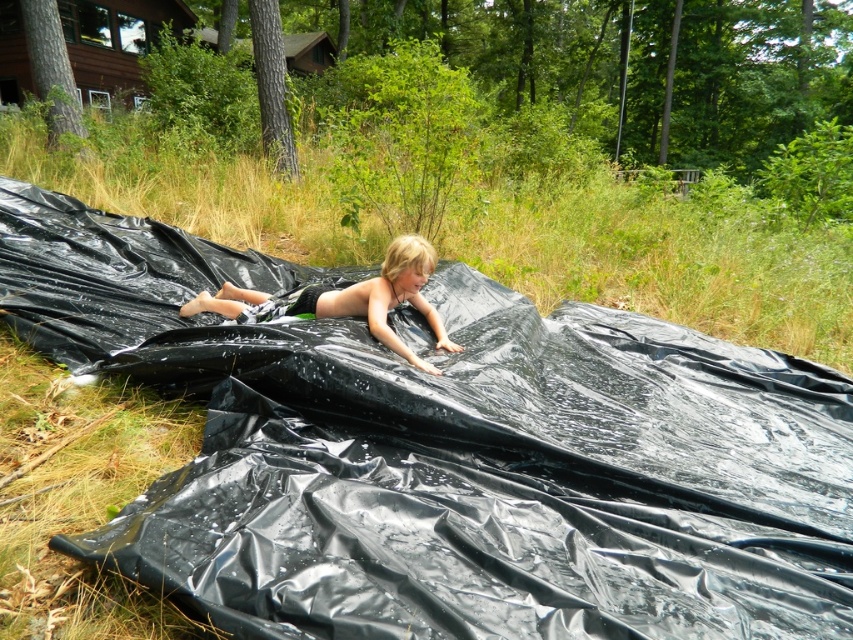
Question: Is green grass at center above blonde hair boy at center?

Choices:
 (A) no
 (B) yes

Answer: (B)

Question: Does green grass at center appear under blonde hair boy at center?

Choices:
 (A) no
 (B) yes

Answer: (A)

Question: Among these points, which one is nearest to the camera?

Choices:
 (A) (329, 307)
 (B) (785, 333)

Answer: (A)

Question: Which object appears farthest from the camera in this image?

Choices:
 (A) green grass at center
 (B) blonde hair boy at center

Answer: (A)

Question: Where is green grass at center located in relation to blonde hair boy at center in the image?

Choices:
 (A) left
 (B) right

Answer: (B)